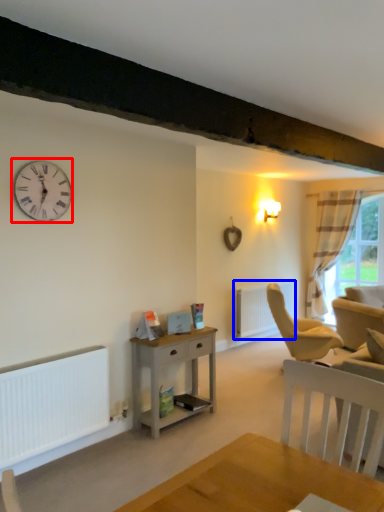
Question: Among these objects, which one is nearest to the camera, wall clock (highlighted by a red box) or radiator (highlighted by a blue box)?

Choices:
 (A) wall clock
 (B) radiator

Answer: (A)